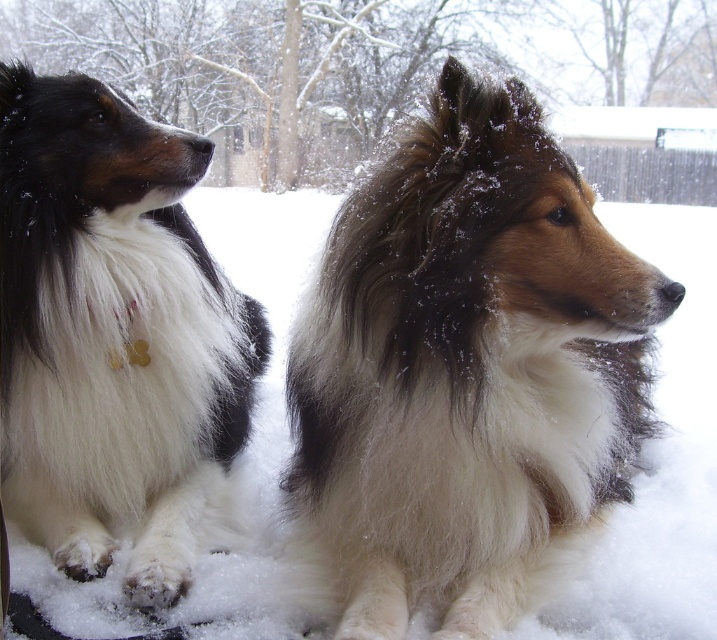
Question: Can you confirm if fluffy white dog at center is positioned below fluffy white dog at left?

Choices:
 (A) yes
 (B) no

Answer: (A)

Question: Is fluffy white dog at center to the left of fluffy white dog at left from the viewer's perspective?

Choices:
 (A) no
 (B) yes

Answer: (A)

Question: Can you confirm if fluffy white dog at center is smaller than fluffy white dog at left?

Choices:
 (A) no
 (B) yes

Answer: (A)

Question: Which object appears farthest from the camera in this image?

Choices:
 (A) fluffy white dog at center
 (B) fluffy white dog at left

Answer: (B)